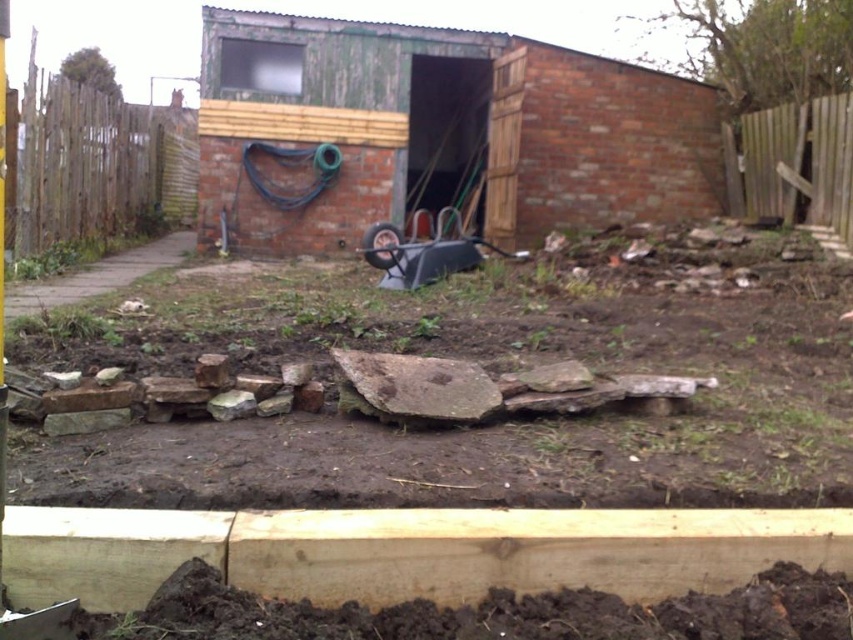
Question: Which point is farther to the camera?

Choices:
 (A) wooden fence at left
 (B) wooden fence at right
 (C) green weathered shed at center

Answer: (C)

Question: Can you confirm if wooden fence at left is thinner than wooden fence at right?

Choices:
 (A) yes
 (B) no

Answer: (B)

Question: Considering the real-world distances, which object is closest to the green weathered shed at center?

Choices:
 (A) wooden fence at right
 (B) wooden fence at left

Answer: (A)

Question: Where is wooden fence at left located in relation to wooden fence at right in the image?

Choices:
 (A) above
 (B) below

Answer: (A)

Question: Is wooden fence at left wider than wooden fence at right?

Choices:
 (A) yes
 (B) no

Answer: (A)

Question: Considering the real-world distances, which object is farthest from the wooden fence at right?

Choices:
 (A) wooden fence at left
 (B) green weathered shed at center

Answer: (A)